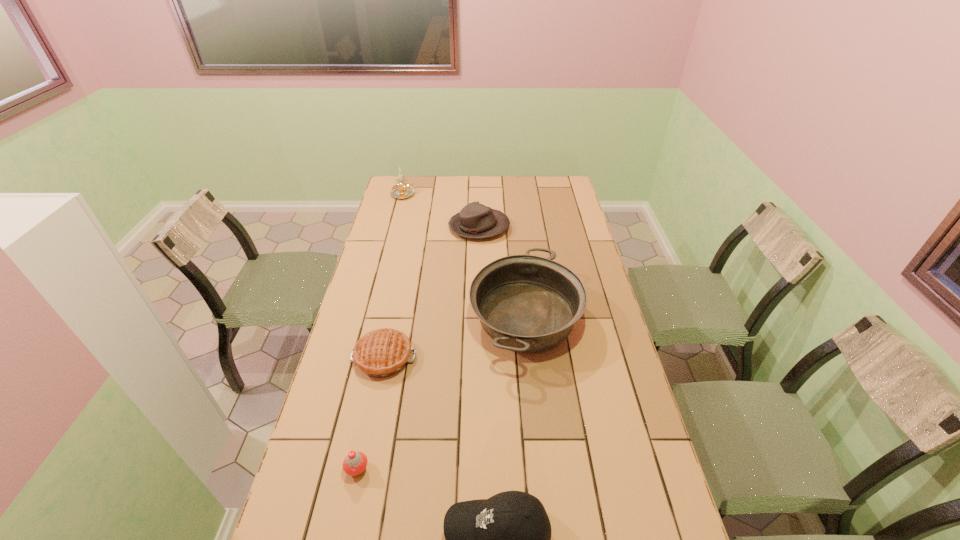
What are the coordinates of `the farthest object` in the screenshot? It's located at (403, 190).

Find the location of a particular element. Image resolution: width=960 pixels, height=540 pixels. pan is located at coordinates (526, 303).

Identify the location of the fourth tallest object. (475, 220).

Find the location of a particular element. the second farthest object is located at coordinates (475, 220).

Identify the location of cupcake. (354, 464).

Identify the location of pie. The height and width of the screenshot is (540, 960). (381, 353).

This screenshot has width=960, height=540. What are the coordinates of `free space located 0.240m on the back of the pan` in the screenshot? It's located at (516, 235).

Locate an element on the screen. Image resolution: width=960 pixels, height=540 pixels. free region located 0.270m on the decorative side of the third shortest object is located at coordinates pos(570,228).

Find the location of `free location located on the right of the fifth farthest object`. free location located on the right of the fifth farthest object is located at coordinates (412, 469).

Find the location of `vacant space located on the left of the pie`. vacant space located on the left of the pie is located at coordinates (336, 357).